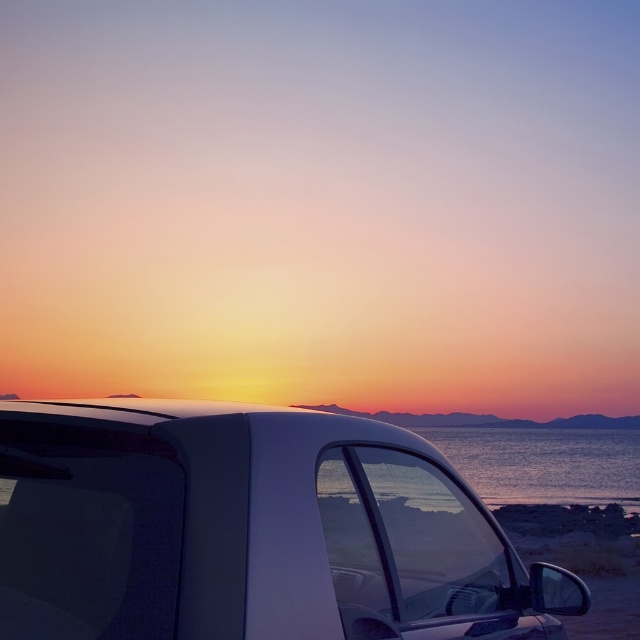
You are a photographer trying to capture the sunset. You have a camera with a 12mm lens that can capture a width of 60cm. You see the white glossy car at center and the shiny blue water at center in your viewfinder. Can both objects fit in the frame at the same time?

The white glossy car at center is smaller than the shiny blue water at center. Since the total width required to include both objects would exceed the 60cm capacity of the 12mm lens, it is unlikely both can fit simultaneously.

You are a photographer trying to capture the sunset reflection on the shiny blue water at center. There is a white glossy car at center in the way. Can you move the car to the right to get a clear shot of the water?

The white glossy car at center is already to the left of the shiny blue water at center, so moving it further right would block the water more. To get a clear shot, you might need to move the car to the left instead.